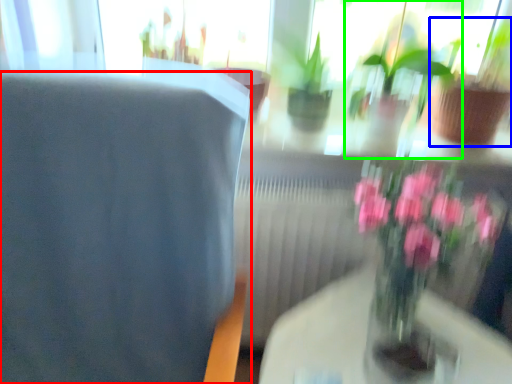
Question: Based on their relative distances, which object is farther from chair (highlighted by a red box)? Choose from houseplant (highlighted by a blue box) and houseplant (highlighted by a green box).

Choices:
 (A) houseplant
 (B) houseplant

Answer: (A)